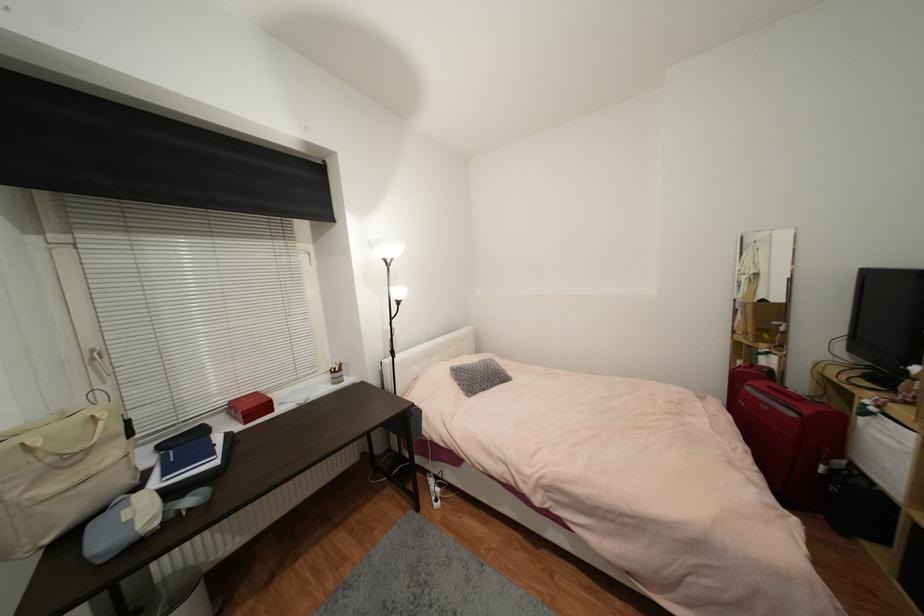
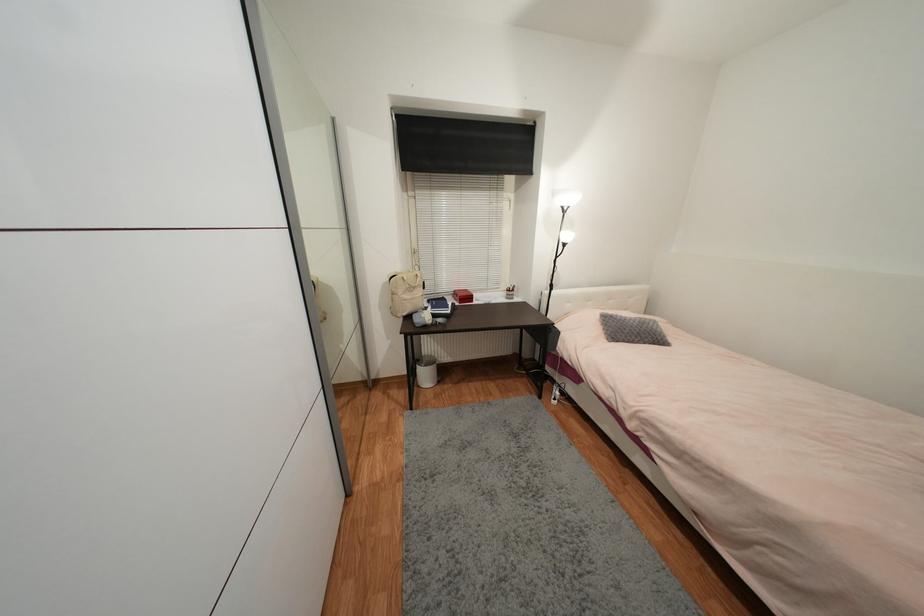
In the second image, find the point that corresponds to [423,477] in the first image.

(553, 383)